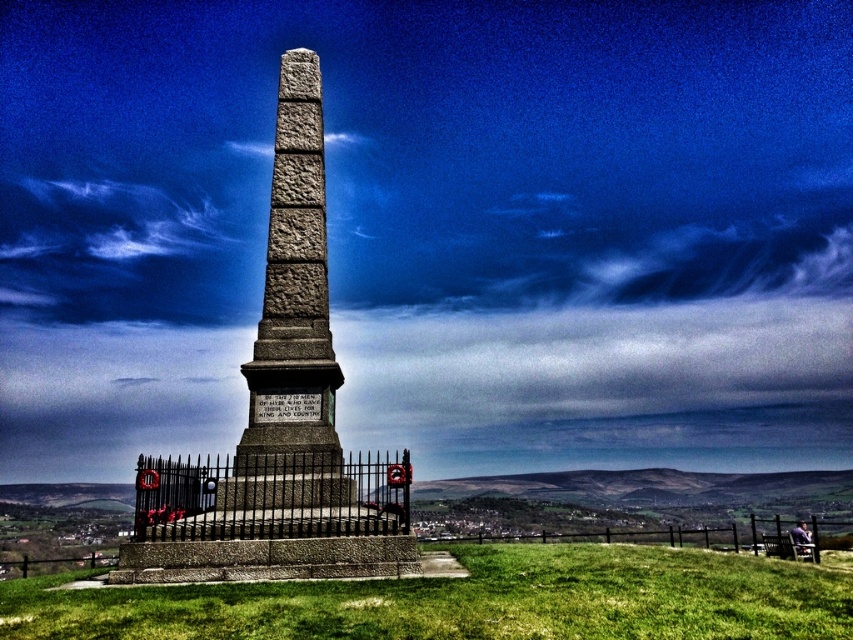
Does granite obelisk at center have a larger size compared to green grass at center?

Correct, granite obelisk at center is larger in size than green grass at center.

Locate an element on the screen. granite obelisk at center is located at coordinates (280, 419).

Does point (386, 504) come farther from viewer compared to point (393, 593)?

Yes, it is behind point (393, 593).

Find the location of a particular element. granite obelisk at center is located at coordinates (280, 419).